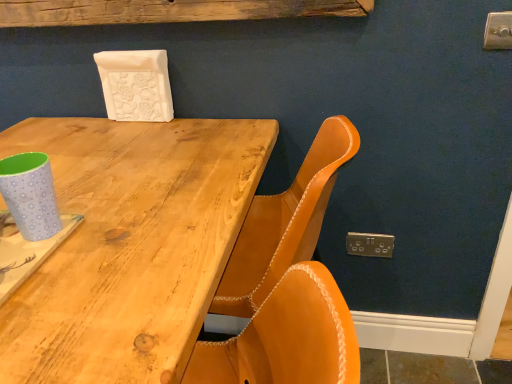
Question: Can you confirm if rustic wood plank at upper center is shorter than natural wood table at center?

Choices:
 (A) no
 (B) yes

Answer: (B)

Question: From the image's perspective, is rustic wood plank at upper center over natural wood table at center?

Choices:
 (A) yes
 (B) no

Answer: (A)

Question: Are rustic wood plank at upper center and natural wood table at center far apart?

Choices:
 (A) no
 (B) yes

Answer: (A)

Question: Does rustic wood plank at upper center touch natural wood table at center?

Choices:
 (A) no
 (B) yes

Answer: (A)

Question: Is rustic wood plank at upper center turned away from natural wood table at center?

Choices:
 (A) no
 (B) yes

Answer: (A)

Question: Looking at the image, does natural wood table at center seem bigger or smaller compared to rustic wood plank at upper center?

Choices:
 (A) small
 (B) big

Answer: (B)

Question: Is natural wood table at center spatially inside rustic wood plank at upper center, or outside of it?

Choices:
 (A) outside
 (B) inside

Answer: (A)

Question: Considering their positions, is natural wood table at center located in front of or behind rustic wood plank at upper center?

Choices:
 (A) behind
 (B) front

Answer: (B)

Question: In terms of height, does natural wood table at center look taller or shorter compared to rustic wood plank at upper center?

Choices:
 (A) tall
 (B) short

Answer: (A)

Question: Considering the positions of point (355, 233) and point (287, 1), is point (355, 233) closer or farther from the camera than point (287, 1)?

Choices:
 (A) closer
 (B) farther

Answer: (B)

Question: Would you say gold metallic electric outlet at lower right is inside or outside rustic wood plank at upper center?

Choices:
 (A) inside
 (B) outside

Answer: (B)

Question: Based on their sizes in the image, would you say gold metallic electric outlet at lower right is bigger or smaller than rustic wood plank at upper center?

Choices:
 (A) small
 (B) big

Answer: (A)

Question: From the image's perspective, relative to rustic wood plank at upper center, is gold metallic electric outlet at lower right above or below?

Choices:
 (A) above
 (B) below

Answer: (B)

Question: From the image's perspective, is rustic wood plank at upper center located above or below light blue polka dot paper cup at left?

Choices:
 (A) below
 (B) above

Answer: (B)

Question: Is rustic wood plank at upper center wider or thinner than light blue polka dot paper cup at left?

Choices:
 (A) wide
 (B) thin

Answer: (B)